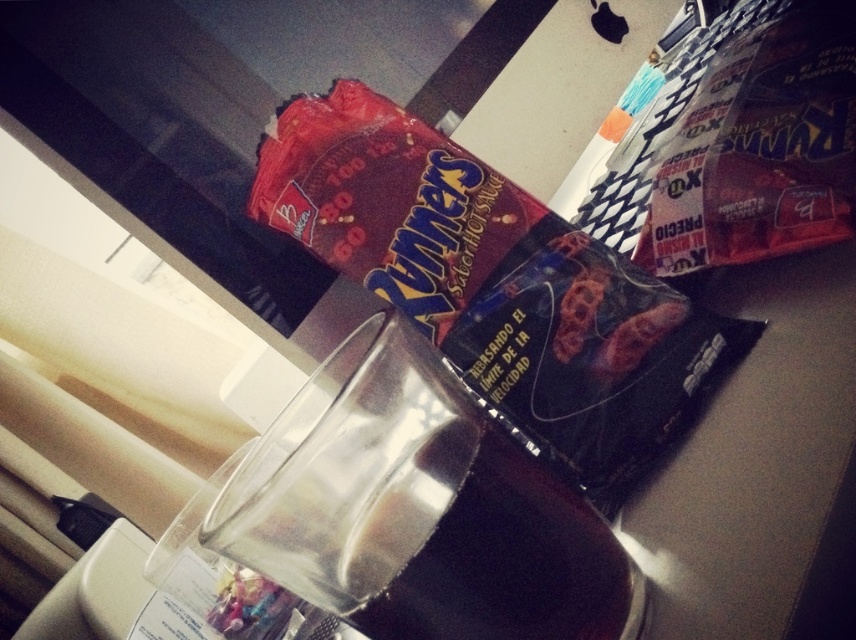
Does matte plastic bag of ruffles at upper center have a lesser width compared to clear glass beverage at center?

No, matte plastic bag of ruffles at upper center is not thinner than clear glass beverage at center.

Who is shorter, matte plastic bag of ruffles at upper center or clear glass beverage at center?

Standing shorter between the two is clear glass beverage at center.

Does point (408, 300) come behind point (531, 602)?

That is True.

Find the location of `matte plastic bag of ruffles at upper center`. matte plastic bag of ruffles at upper center is located at coordinates (494, 282).